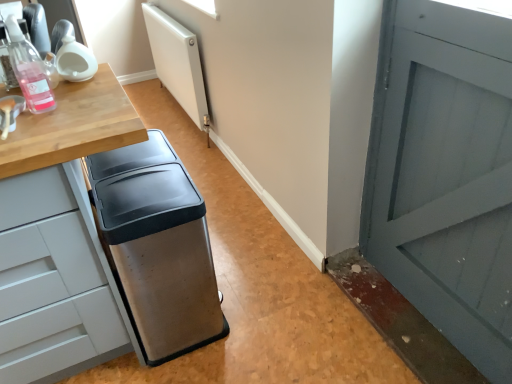
Question: Is white matte radiator at upper center oriented away from stainless steel trash can at center?

Choices:
 (A) yes
 (B) no

Answer: (B)

Question: Is white matte radiator at upper center bigger than stainless steel trash can at center?

Choices:
 (A) yes
 (B) no

Answer: (B)

Question: From a real-world perspective, is white matte radiator at upper center located beneath stainless steel trash can at center?

Choices:
 (A) yes
 (B) no

Answer: (B)

Question: Considering the relative sizes of white matte radiator at upper center and stainless steel trash can at center in the image provided, is white matte radiator at upper center taller than stainless steel trash can at center?

Choices:
 (A) no
 (B) yes

Answer: (B)

Question: Is white matte radiator at upper center oriented towards stainless steel trash can at center?

Choices:
 (A) yes
 (B) no

Answer: (B)

Question: Is white matte radiator at upper center in front of stainless steel trash can at center?

Choices:
 (A) no
 (B) yes

Answer: (A)

Question: Does translucent plastic bottle at left have a lesser height compared to stainless steel trash can at center?

Choices:
 (A) yes
 (B) no

Answer: (A)

Question: From a real-world perspective, is translucent plastic bottle at left on top of stainless steel trash can at center?

Choices:
 (A) yes
 (B) no

Answer: (A)

Question: From the image's perspective, is translucent plastic bottle at left located beneath stainless steel trash can at center?

Choices:
 (A) yes
 (B) no

Answer: (B)

Question: Is translucent plastic bottle at left taller than stainless steel trash can at center?

Choices:
 (A) no
 (B) yes

Answer: (A)

Question: Would you say stainless steel trash can at center is part of translucent plastic bottle at left's contents?

Choices:
 (A) no
 (B) yes

Answer: (A)

Question: Is translucent plastic bottle at left next to stainless steel trash can at center?

Choices:
 (A) yes
 (B) no

Answer: (B)

Question: Is stainless steel trash can at center facing away from translucent plastic bottle at left?

Choices:
 (A) no
 (B) yes

Answer: (A)